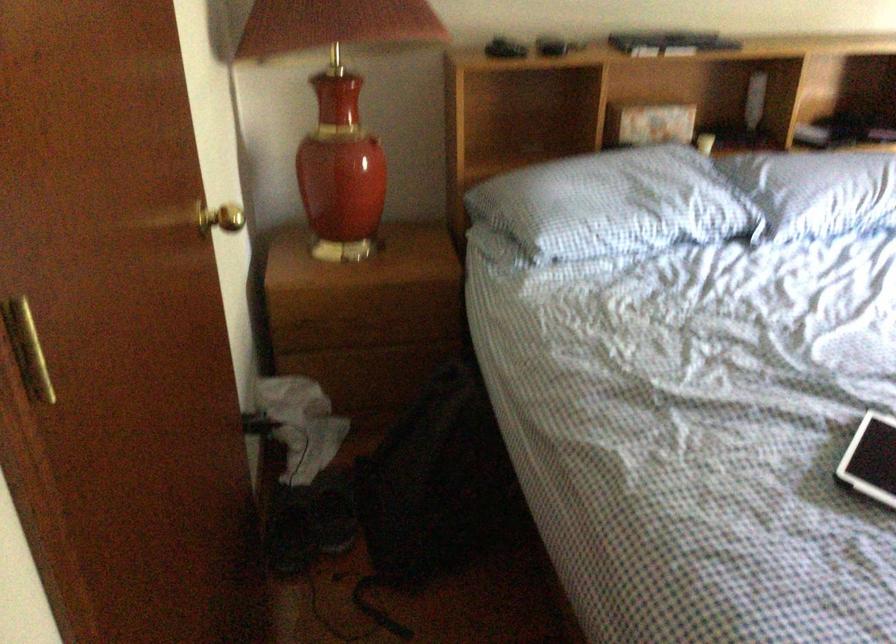
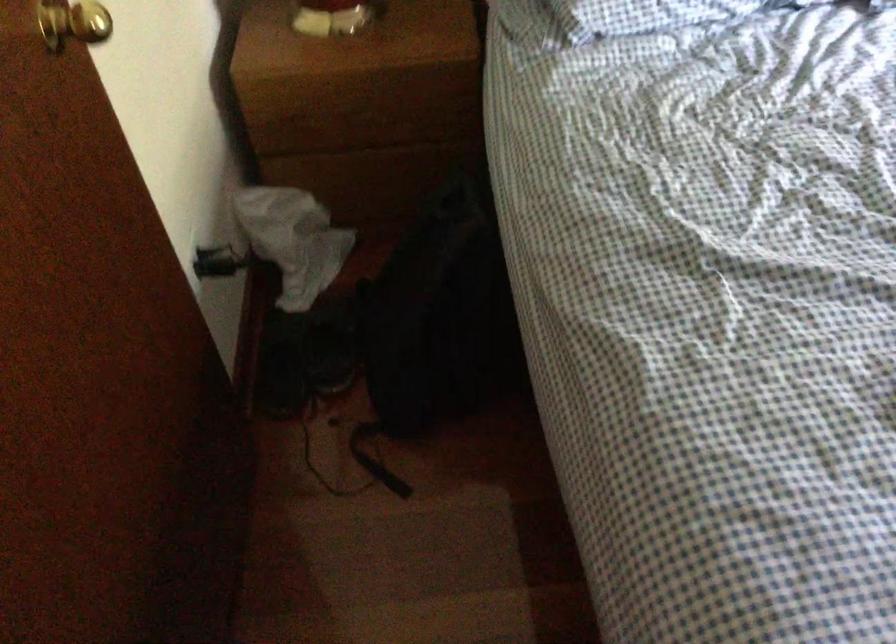
Where in the second image is the point corresponding to the point at 289,527 from the first image?

(282, 363)